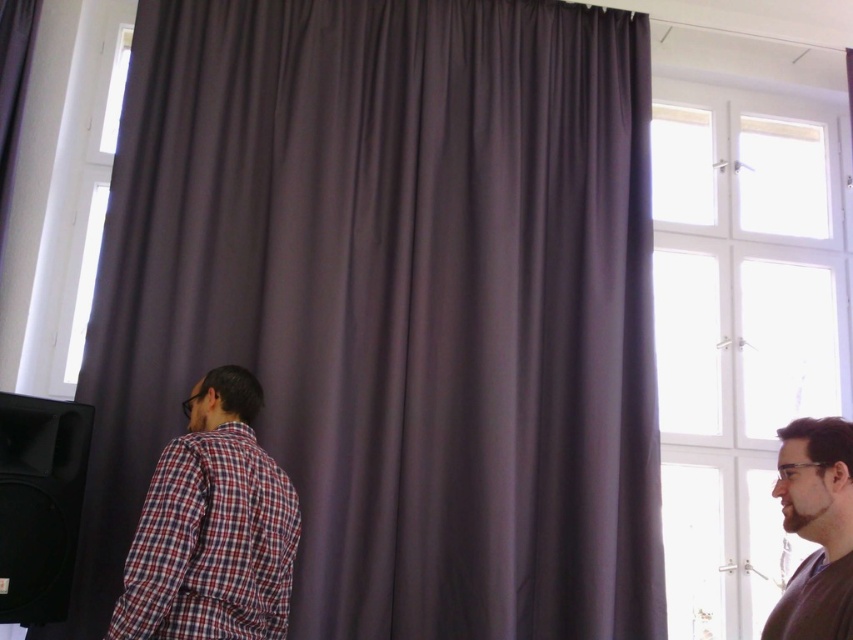
Question: Is the position of purple matte curtain at center less distant than that of brown matte shirt at right?

Choices:
 (A) yes
 (B) no

Answer: (B)

Question: Which object is the closest to the brown matte shirt at right?

Choices:
 (A) purple matte curtain at center
 (B) plaid fabric shirt at left

Answer: (B)

Question: Considering the real-world distances, which object is closest to the brown matte shirt at right?

Choices:
 (A) purple matte curtain at center
 (B) plaid fabric shirt at left

Answer: (B)

Question: Considering the relative positions of purple matte curtain at center and brown matte shirt at right in the image provided, where is purple matte curtain at center located with respect to brown matte shirt at right?

Choices:
 (A) left
 (B) right

Answer: (A)

Question: Is plaid fabric shirt at left to the right of brown matte shirt at right from the viewer's perspective?

Choices:
 (A) no
 (B) yes

Answer: (A)

Question: Which of the following is the farthest from the observer?

Choices:
 (A) click(281, 445)
 (B) click(221, 467)
 (C) click(830, 628)

Answer: (A)